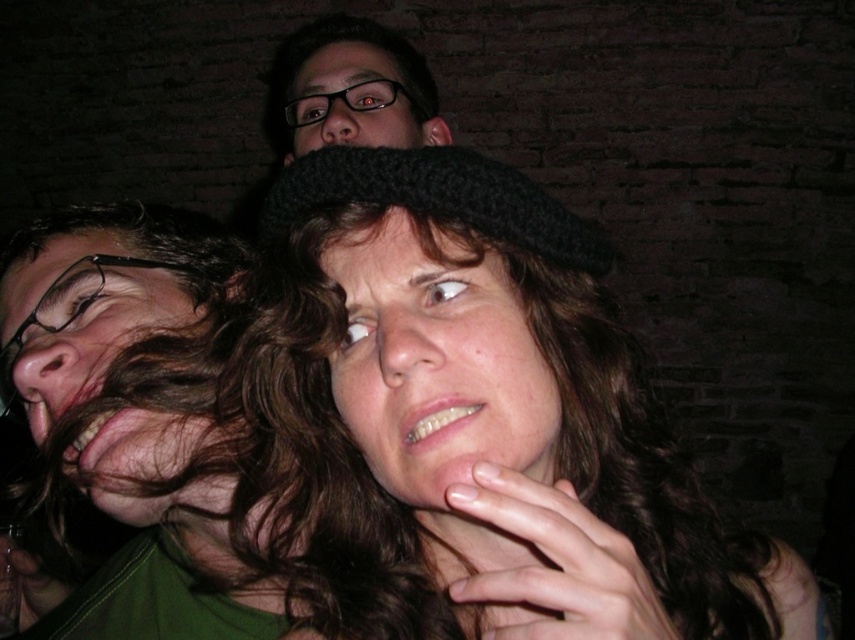
You are a photographer trying to capture a clear shot of both the brown hair at left and the matte black glasses at upper center. Which object is closer to the left edge of the frame?

The brown hair at left is positioned on the left side of matte black glasses at upper center, making it closer to the left edge of the frame.

You are a photographer trying to capture a clear shot of both the black knitted hat at center and the matte black glasses at upper center. Which object should you adjust your camera focus on first to ensure both are in frame?

The matte black glasses at upper center should be focused on first since the black knitted hat at center is to the right of it, allowing you to adjust the frame to include both.

You are a photographer trying to capture a clear shot of both the knitted woolen hat at center and the matte black glasses at upper center. Since the camera can only focus on one object at a time, which object should you choose to ensure it appears sharp and in focus?

The knitted woolen hat at center is closer to the viewer than the matte black glasses at upper center. Since the camera can only focus on one object at a time, focusing on the knitted woolen hat at center will ensure it appears sharp, while the matte black glasses at upper center may appear slightly out of focus due to the depth of field limitations.